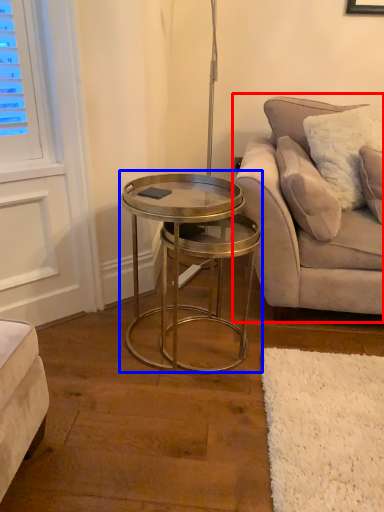
Question: Which object is further to the camera taking this photo, studio couch (highlighted by a red box) or coffee table (highlighted by a blue box)?

Choices:
 (A) studio couch
 (B) coffee table

Answer: (A)